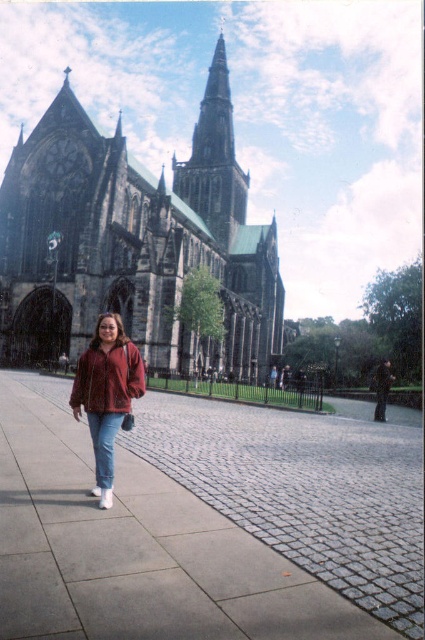
You are standing in front of the cathedral and want to take a photo of the gray stone pavement at center and the dark gray stone spire at center. Which object should you focus on first if you want to capture both in a single frame without moving the camera?

The gray stone pavement at center should be focused on first because it is shorter than the dark gray stone spire at center, allowing both to be in the frame without needing to adjust the camera angle.

You are a photographer trying to capture the cathedral and the person in the same frame. Since the blue denim jeans at lower left and the dark gray stone spire at center are both in your view, which one should you focus on first to ensure they are both in focus?

You should focus on the dark gray stone spire at center first because the blue denim jeans at lower left is behind it, so adjusting focus starting from the farther object will help both be in focus.

You are a photographer aiming to capture the entire dark gray stone spire at center and velvet maroon sweatshirt at center in a single frame. Based on their sizes, is it possible to include both without cropping either object?

The dark gray stone spire at center might be wider than the velvet maroon sweatshirt at center, so it depends on the camera angle and distance. If the spire is wider, positioning the camera to include both might require a wider lens or adjusting the framing to ensure both fit within the shot.